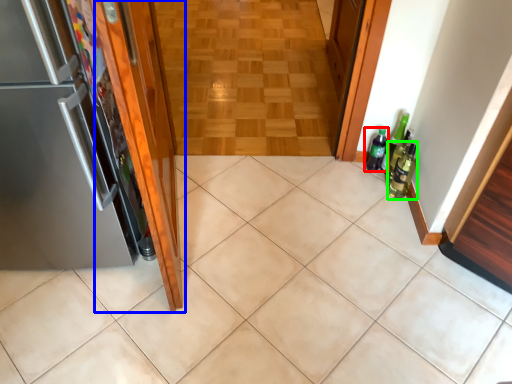
Question: Based on their relative distances, which object is nearer to bottle (highlighted by a red box)? Choose from door (highlighted by a blue box) and beer bottle (highlighted by a green box).

Choices:
 (A) door
 (B) beer bottle

Answer: (B)